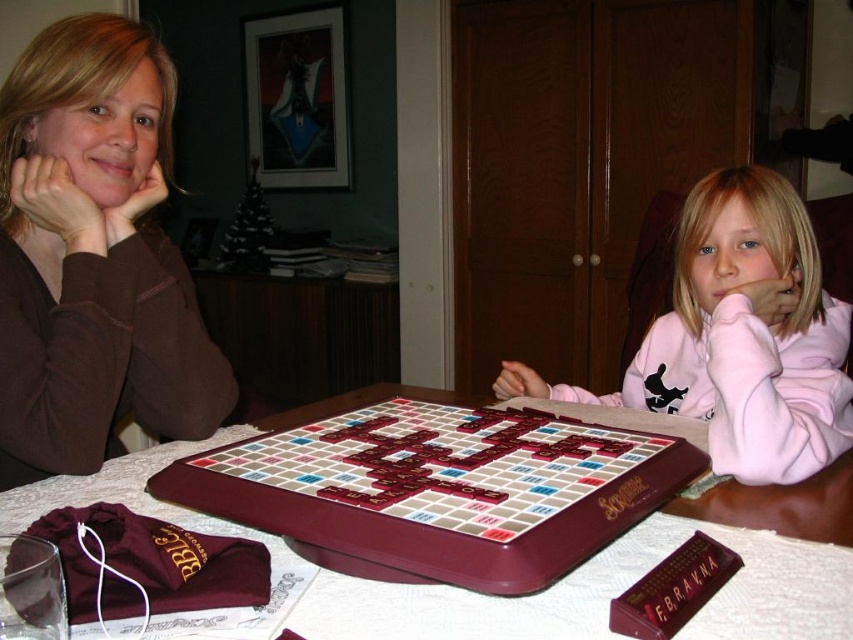
You are sitting at the table playing Scrabble and notice the brown fabric at left. Where exactly is it positioned relative to the Scrabble board?

The brown fabric at left is positioned at point (93, 257) relative to the Scrabble board.

You are a photographer standing at the camera position. You want to take a closeup shot of the brown fabric at left without moving the camera. Is it possible to do so given the distance?

The brown fabric at left is 31.15 inches away from the camera, so yes, you can take a closeup shot without moving the camera since the distance is manageable for a closeup.

You are a guest at a dinner party and see the brown fabric at left and the maroon wooden table at center. Which object is closer to the ceiling?

The brown fabric at left is closer to the ceiling because it is located above the maroon wooden table at center.